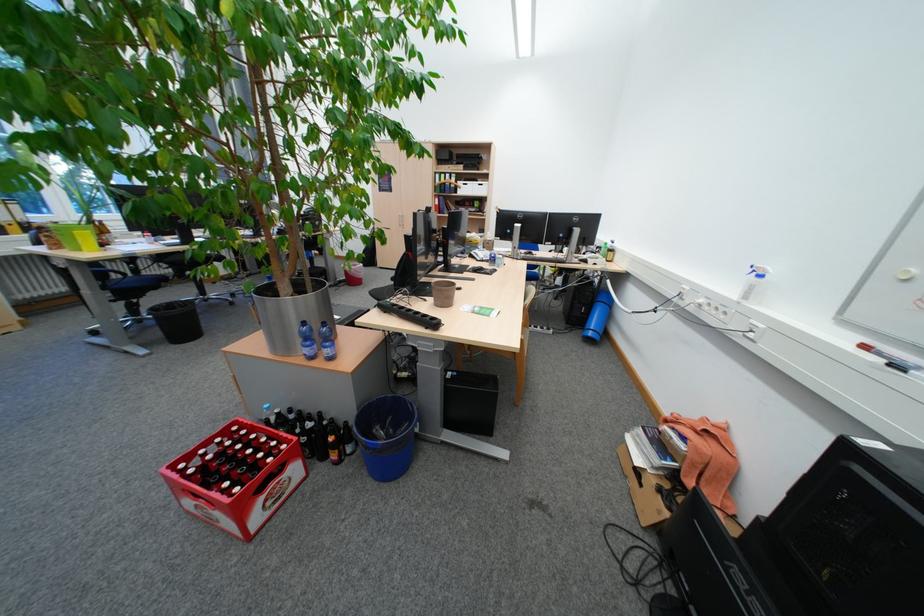
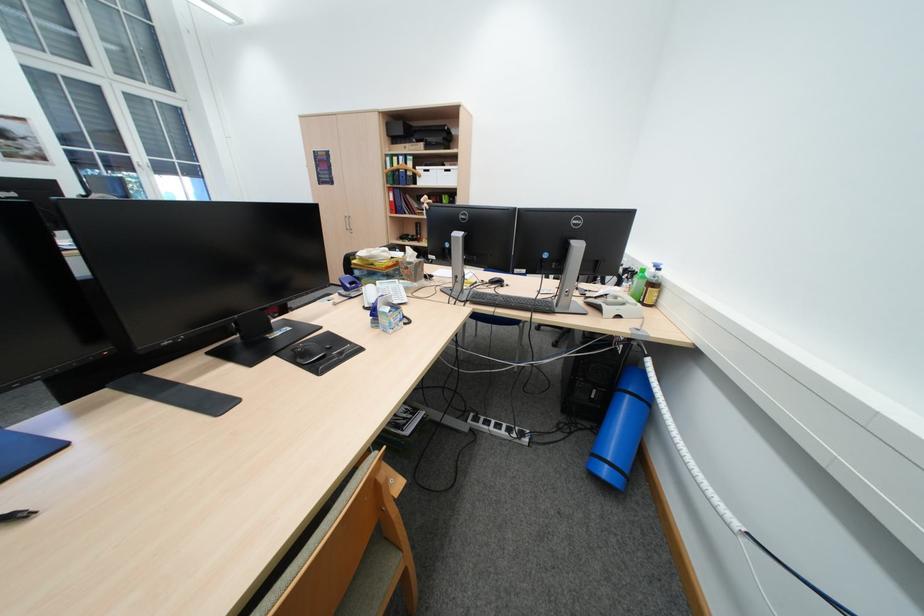
The point at (x=480, y=190) is marked in the first image. Where is the corresponding point in the second image?

(442, 179)